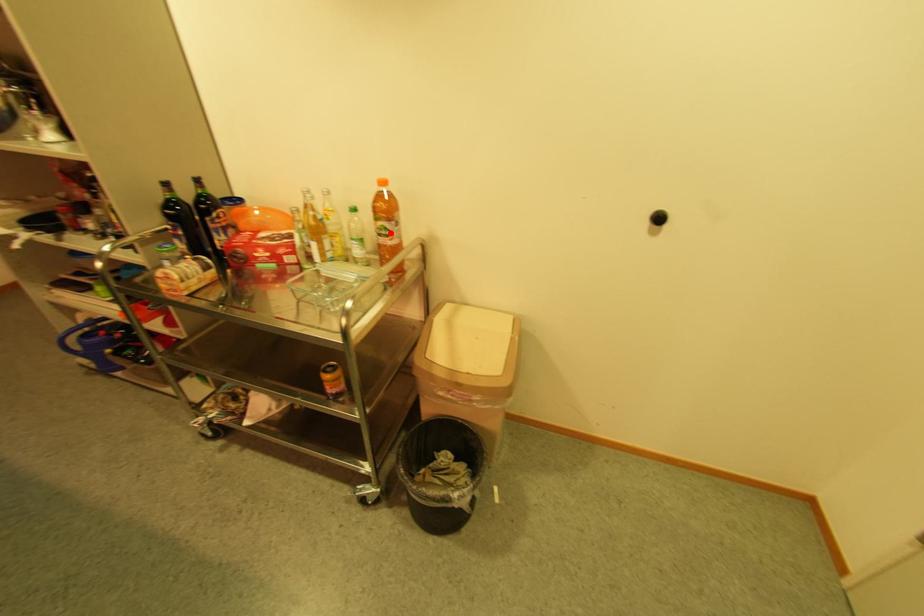
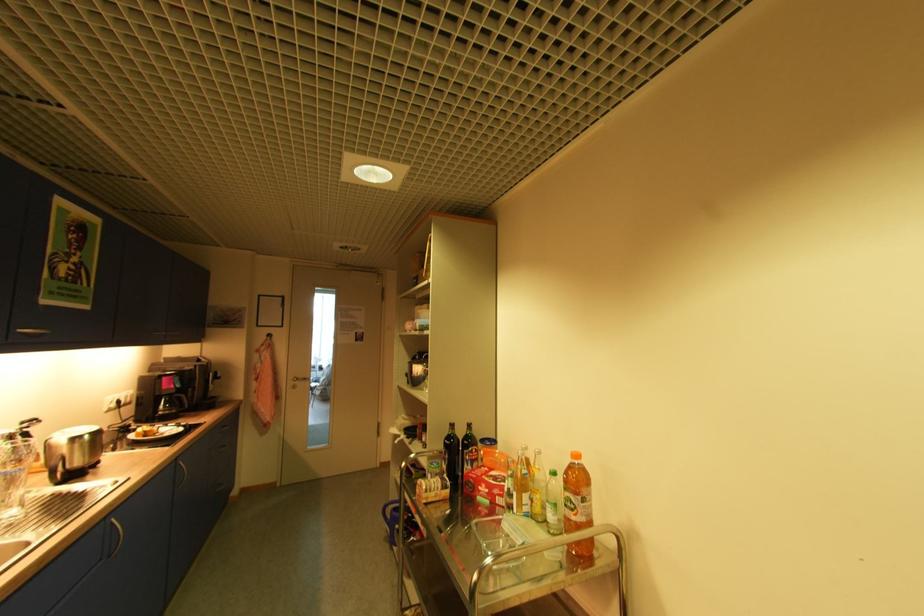
Question: I am providing you with two images of the same scene from different viewpoints. Image1 has a red point marked. In image2, the corresponding 3D location appears at what relative position? Reply with the corresponding letter.

Choices:
 (A) Closer
 (B) Farther

Answer: (B)